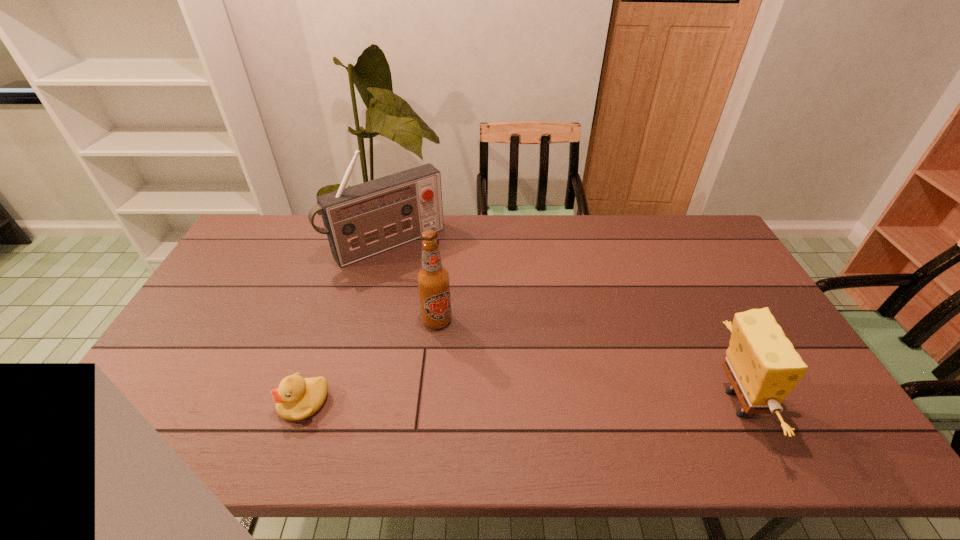
Locate an element on the screen. This screenshot has width=960, height=540. object located at the near right corner is located at coordinates pyautogui.click(x=761, y=363).

This screenshot has width=960, height=540. Find the location of `vacant area at the far edge of the desktop`. vacant area at the far edge of the desktop is located at coordinates (587, 230).

Find the location of a particular element. free space at the near edge of the desktop is located at coordinates (728, 403).

At what (x,y) coordinates should I click in order to perform the action: click on free location at the right edge. Please return your answer as a coordinate pair (x, y). The image size is (960, 540). Looking at the image, I should click on (744, 282).

Where is `vacant space at the near left corner of the desktop`? The width and height of the screenshot is (960, 540). vacant space at the near left corner of the desktop is located at coordinates (193, 386).

The height and width of the screenshot is (540, 960). In the image, there is a desktop. In order to click on vacant space at the far right corner in this screenshot , I will do `click(711, 228)`.

Find the location of a particular element. The width and height of the screenshot is (960, 540). free space that is in between the farthest object and the duckling is located at coordinates (346, 323).

The width and height of the screenshot is (960, 540). Identify the location of vacant space that is in between the second tallest object and the duckling. (371, 361).

This screenshot has width=960, height=540. In order to click on empty space that is in between the third shortest object and the third tallest object in this screenshot , I will do `click(587, 362)`.

Find the location of a particular element. unoccupied position between the sponge and the second farthest object is located at coordinates (587, 362).